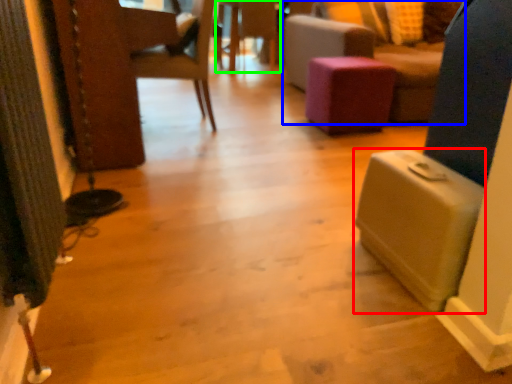
Question: Which object is the closest to the lift (highlighted by a red box)? Choose among these: furniture (highlighted by a blue box) or side table (highlighted by a green box).

Choices:
 (A) furniture
 (B) side table

Answer: (A)